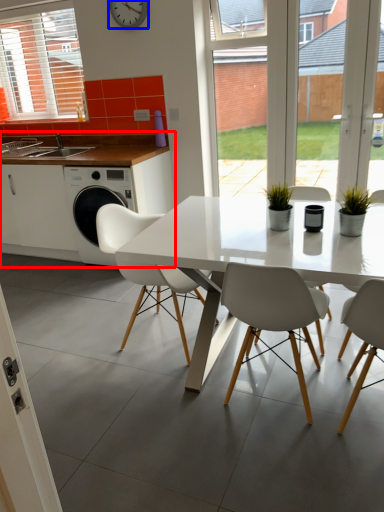
Question: Among these objects, which one is farthest to the camera, cabinetry (highlighted by a red box) or clock (highlighted by a blue box)?

Choices:
 (A) cabinetry
 (B) clock

Answer: (A)